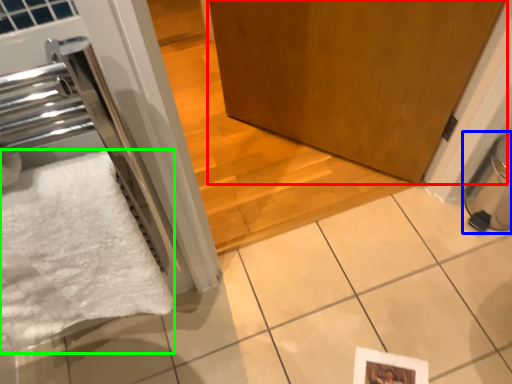
Question: Based on their relative distances, which object is farther from door (highlighted by a red box)? Choose from water heater (highlighted by a blue box) and bath towel (highlighted by a green box).

Choices:
 (A) water heater
 (B) bath towel

Answer: (B)